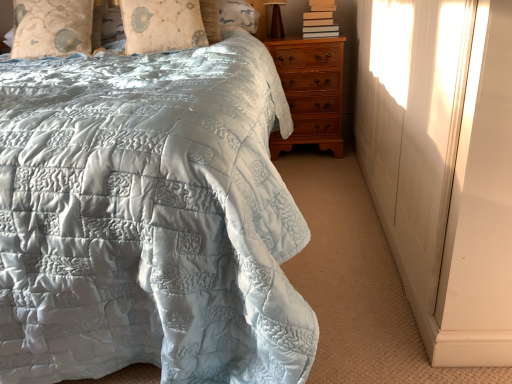
Question: In the image, is brown wooden table lamp at upper right on the left side or the right side of hardcover books at upper right?

Choices:
 (A) left
 (B) right

Answer: (A)

Question: Is point (274, 29) closer or farther from the camera than point (332, 1)?

Choices:
 (A) farther
 (B) closer

Answer: (A)

Question: Based on their relative distances, which object is nearer to the matte quilted bedspread at center?

Choices:
 (A) hardcover books at upper right
 (B) brown wooden table lamp at upper right
 (C) silky beige pillow at upper center, the 1th pillow in the right-to-left sequence
 (D) light blue quilted pillow at upper left, arranged as the first pillow when viewed from the left
 (E) light brown wood chest of drawers at right

Answer: (C)

Question: Estimate the real-world distances between objects in this image. Which object is farther from the matte quilted bedspread at center?

Choices:
 (A) light brown wood chest of drawers at right
 (B) brown wooden table lamp at upper right
 (C) hardcover books at upper right
 (D) light blue quilted pillow at upper left, marked as the 2th pillow in a right-to-left arrangement
 (E) silky beige pillow at upper center, arranged as the second pillow when viewed from the left

Answer: (B)